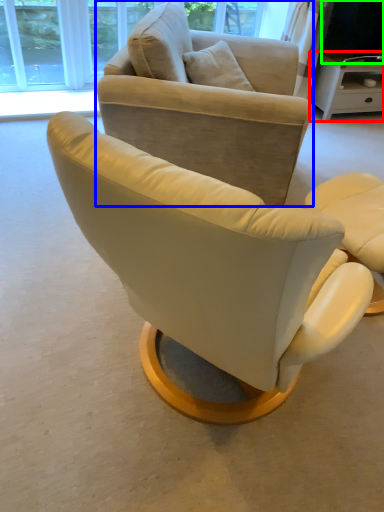
Question: Considering the real-world distances, which object is farthest from desk (highlighted by a red box)? chair (highlighted by a blue box) or television (highlighted by a green box)?

Choices:
 (A) chair
 (B) television

Answer: (A)